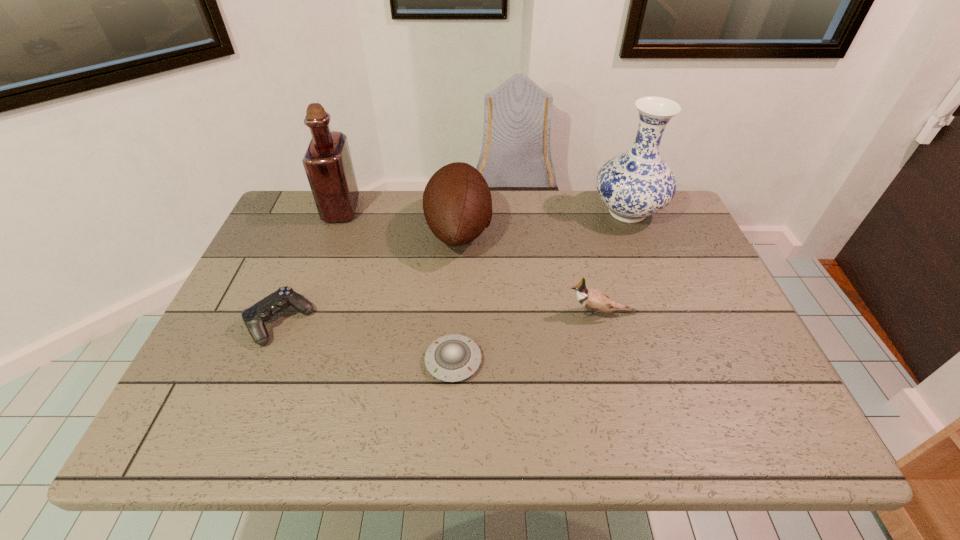
This screenshot has width=960, height=540. I want to click on object that is at the far left corner, so click(327, 162).

The image size is (960, 540). In order to click on object that is at the far right corner in this screenshot , I will do `click(635, 184)`.

What are the coordinates of `free space at the far edge of the desktop` in the screenshot? It's located at (368, 214).

Locate an element on the screen. The image size is (960, 540). free region at the near edge of the desktop is located at coordinates (277, 413).

I want to click on free space at the right edge, so click(x=715, y=283).

Image resolution: width=960 pixels, height=540 pixels. Identify the location of free spot at the far left corner of the desktop. (318, 225).

At what (x,y) coordinates should I click in order to perform the action: click on free space at the far right corner. Please return your answer as a coordinate pair (x, y). The width and height of the screenshot is (960, 540). Looking at the image, I should click on (636, 227).

This screenshot has width=960, height=540. I want to click on blank area at the near right corner, so click(x=713, y=412).

Locate an element on the screen. free space that is in between the vase and the fourth tallest object is located at coordinates (614, 263).

In order to click on free spot between the saucer and the vase in this screenshot , I will do `click(540, 287)`.